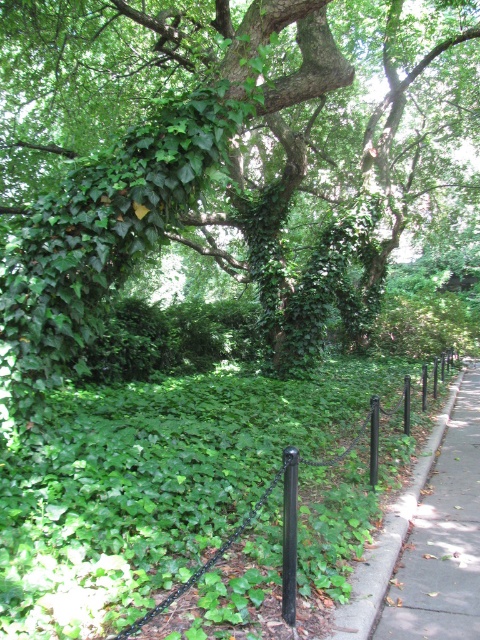
You are standing at the point marked as point [443,538]. You want to walk to the gray concrete sidewalk at right. Which direction should you face to move directly towards it?

Since the gray concrete sidewalk at right is located at point [443,538], you should face directly towards that point to move directly towards it.

You are standing at the point marked as point (372, 432) in the scene. What object are you touching?

The point (372, 432) is on the black metal fence at center, so you are touching the black metal fence at center.

Based on the photo, you are standing at the center of the image and want to walk to the gray concrete sidewalk at right. According to the coordinates provided, in which direction should you move relative to your current position?

The gray concrete sidewalk at right is located at coordinates point (443, 538), which means you should move towards the lower right direction from your current position at the center.